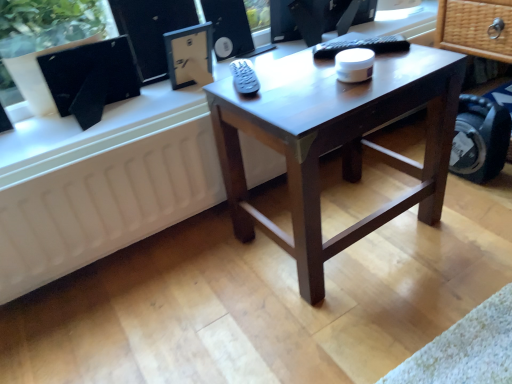
Locate an element on the screen. vacant region to the left of matte dark brown coffee table at center is located at coordinates (200, 281).